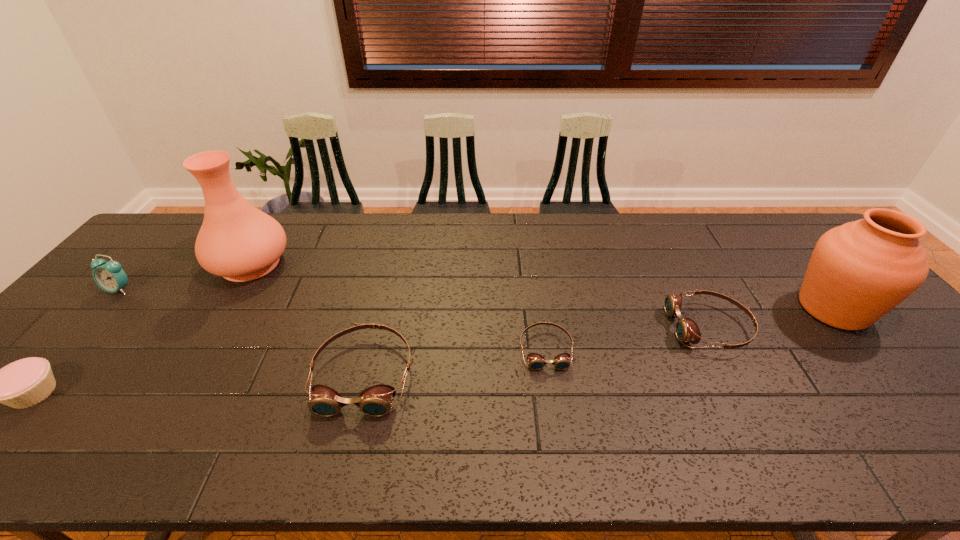
Please point a spot to add another goggles on the right. Please provide its 2D coordinates. Your answer should be formatted as a tuple, i.e. [(x, y)], where the tuple contains the x and y coordinates of a point satisfying the conditions above.

[(858, 306)]